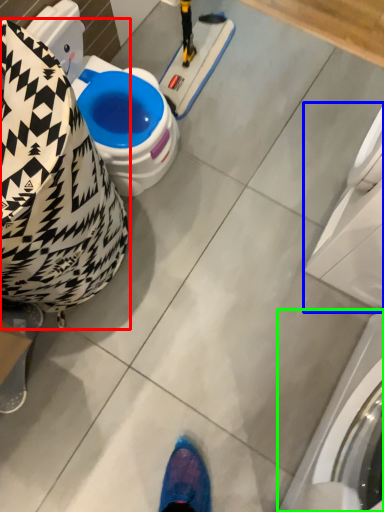
Question: Considering the real-world distances, which object is closest to bean bag chair (highlighted by a red box)? washing machine (highlighted by a blue box) or washing machine (highlighted by a green box).

Choices:
 (A) washing machine
 (B) washing machine

Answer: (A)